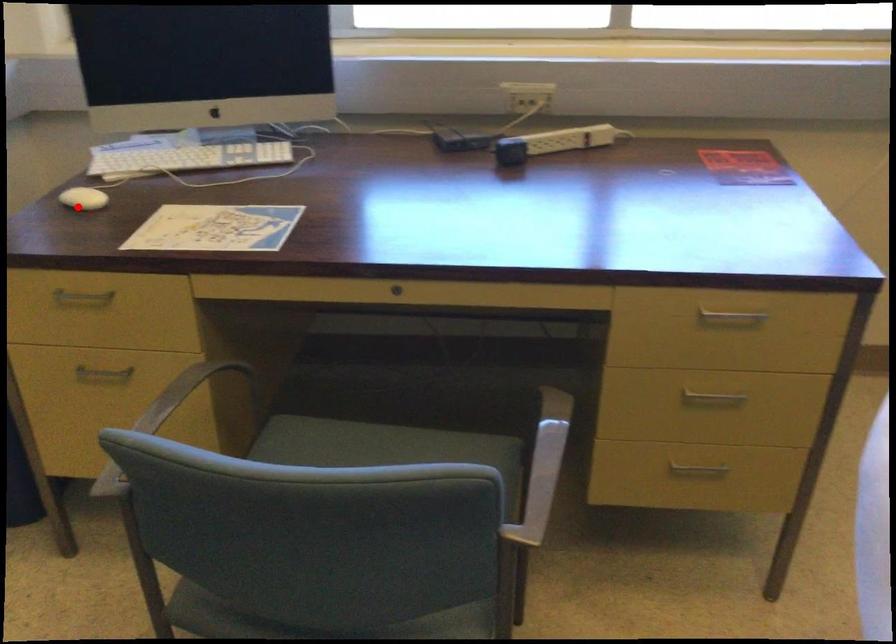
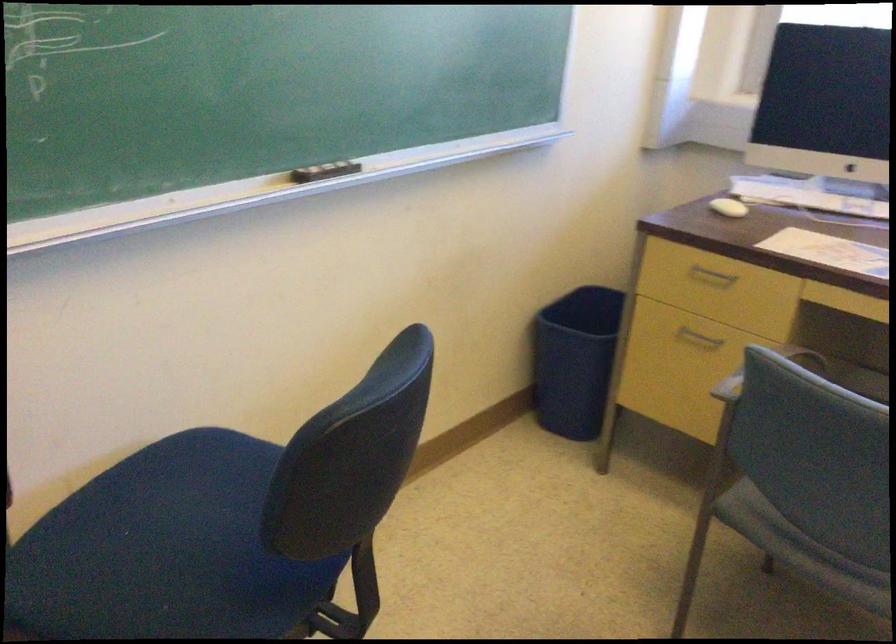
Question: I am providing you with two images of the same scene from different viewpoints. In image1, a red point is highlighted. Considering the same 3D point in image2, which of the following is correct?

Choices:
 (A) It is closer
 (B) It is farther

Answer: (B)